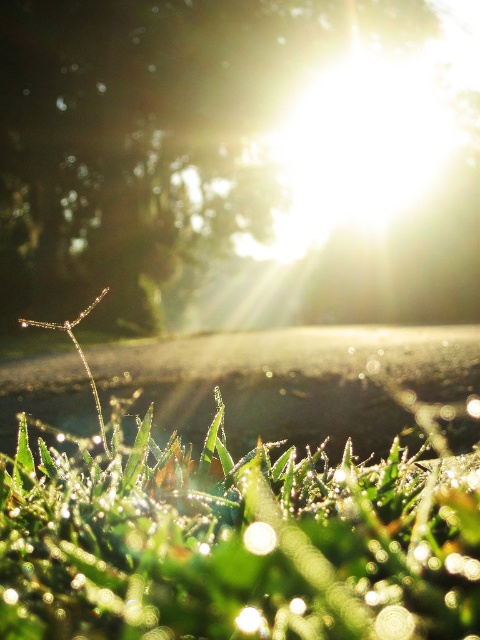
You are standing on the glistening green grass at lower center and want to walk towards the green leafy tree at upper center. Which direction should you move to get closer to the tree?

To get closer to the green leafy tree at upper center, you should move forward since the glistening green grass at lower center is behind the tree, meaning the tree is in front of you.

You are a photographer aiming to capture the height difference between the green leafy tree at upper center and the glistening green grass at lower center in your shot. Based on the scene, which object should you focus on to emphasize the vertical contrast between them?

The green leafy tree at upper center is taller than the glistening green grass at lower center, so focusing on the tree will emphasize the vertical contrast between their heights.